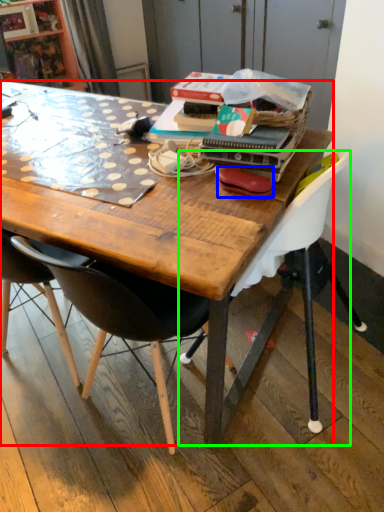
Question: Which is farther away from desk (highlighted by a red box)? handbag (highlighted by a blue box) or chair (highlighted by a green box)?

Choices:
 (A) handbag
 (B) chair

Answer: (A)